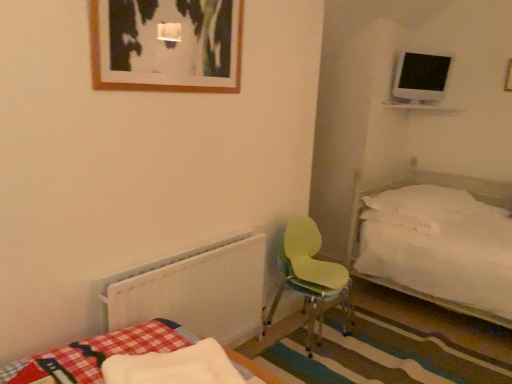
At what (x,y) coordinates should I click in order to perform the action: click on unoccupied region to the right of light green plastic chair at center. Please return your answer as a coordinate pair (x, y). The width and height of the screenshot is (512, 384). Looking at the image, I should click on (377, 344).